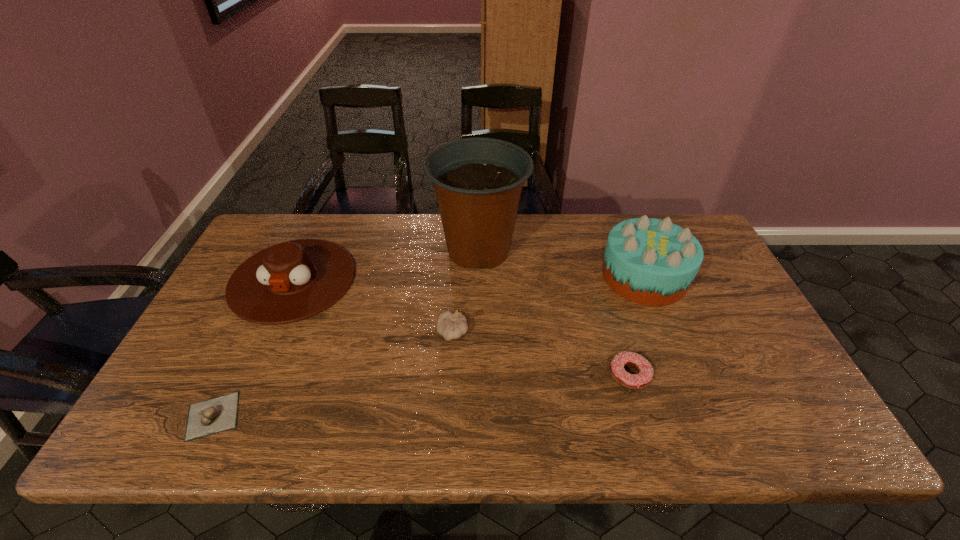
Where is `object that is positioned at the right edge`? This screenshot has width=960, height=540. object that is positioned at the right edge is located at coordinates (649, 261).

The image size is (960, 540). What are the coordinates of `object that is at the far left corner` in the screenshot? It's located at (291, 281).

I want to click on object situated at the near left corner, so click(212, 416).

The image size is (960, 540). Identify the location of object at the far right corner. (649, 261).

Locate an element on the screen. vacant space at the far edge of the desktop is located at coordinates (557, 216).

Image resolution: width=960 pixels, height=540 pixels. Identify the location of vacant space at the left edge. (200, 349).

Where is `free space at the right edge of the desktop`? free space at the right edge of the desktop is located at coordinates (698, 274).

In the image, there is a desktop. Where is `blank space at the far left corner`? blank space at the far left corner is located at coordinates (283, 234).

Identify the location of free point between the cake and the doughnut. (637, 326).

Image resolution: width=960 pixels, height=540 pixels. I want to click on free point between the doughnut and the farther garlic, so click(x=541, y=354).